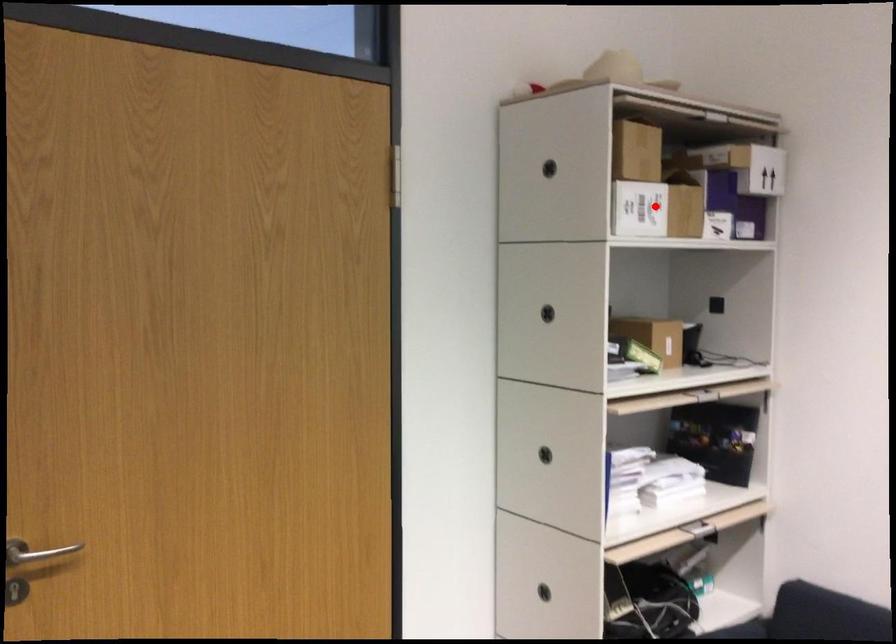
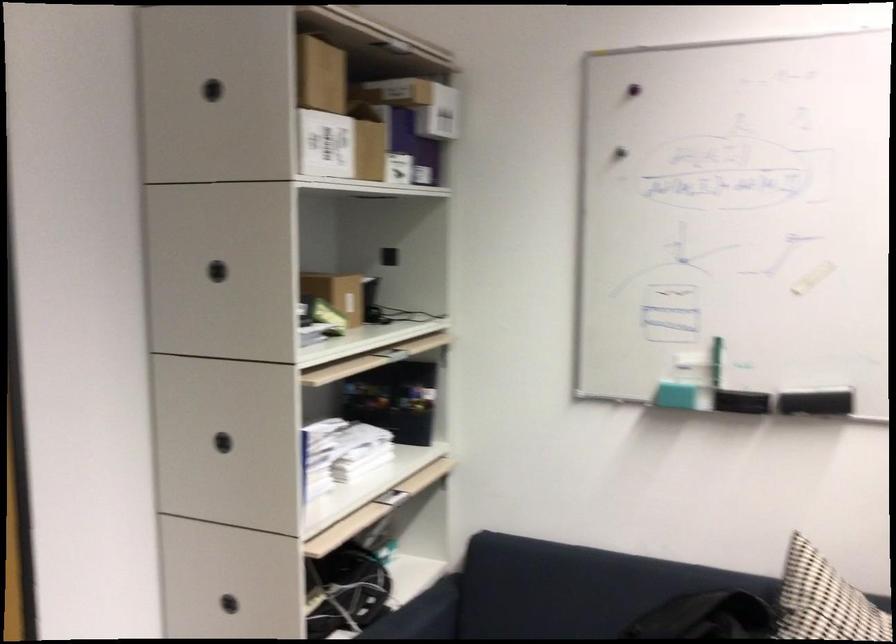
Question: A red point is marked in image1. In image2, is the corresponding 3D point closer to the camera or farther? Reply with the corresponding letter.

Choices:
 (A) The corresponding 3D point is closer.
 (B) The corresponding 3D point is farther.

Answer: (A)